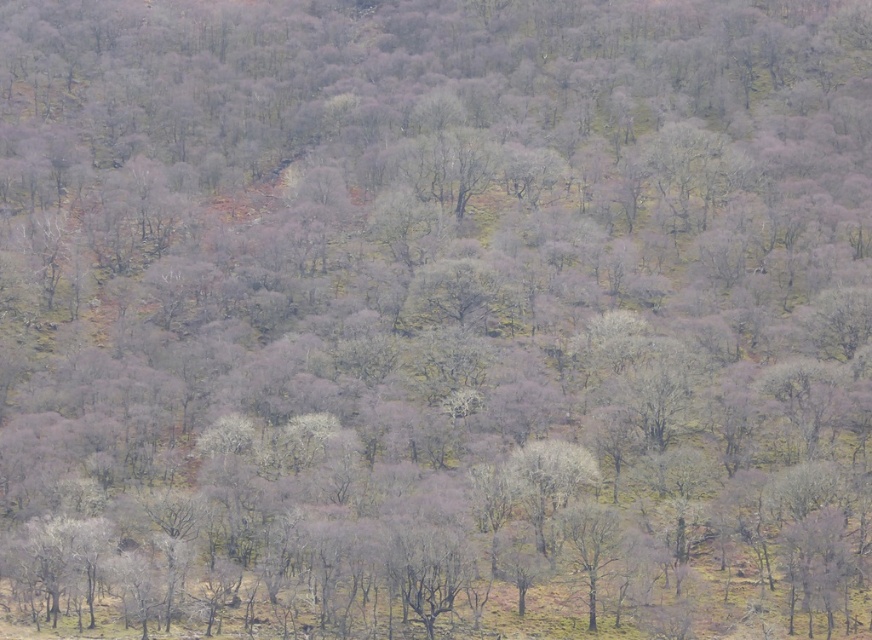
You are standing at the origin point of the coordinate system in the forest scene. Where is the smooth gray tree at center located in terms of coordinates?

The smooth gray tree at center is located at coordinates point [547,481].

You are a hiker trying to identify two trees in the forest. You see a smooth gray tree at center and a smooth bark tree at center. Which one has a wider trunk?

The smooth gray tree at center has a wider trunk than the smooth bark tree at center.